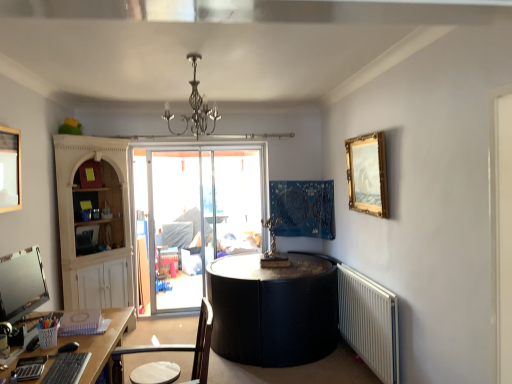
Question: From the image's perspective, is brown wooden chair at lower left located beneath white plastic radiator at lower right?

Choices:
 (A) no
 (B) yes

Answer: (A)

Question: Can you confirm if brown wooden chair at lower left is positioned to the left of white plastic radiator at lower right?

Choices:
 (A) no
 (B) yes

Answer: (B)

Question: Is brown wooden chair at lower left wider than white plastic radiator at lower right?

Choices:
 (A) yes
 (B) no

Answer: (A)

Question: From a real-world perspective, is brown wooden chair at lower left below white plastic radiator at lower right?

Choices:
 (A) yes
 (B) no

Answer: (B)

Question: From a real-world perspective, is brown wooden chair at lower left physically above white plastic radiator at lower right?

Choices:
 (A) yes
 (B) no

Answer: (A)

Question: Would you say white plastic radiator at lower right is part of brown wooden chair at lower left's contents?

Choices:
 (A) yes
 (B) no

Answer: (B)

Question: Does gold/gilded picture frame at upper right, the second picture frame when ordered from left to right, have a lesser height compared to white plastic radiator at lower right?

Choices:
 (A) yes
 (B) no

Answer: (A)

Question: Is gold/gilded picture frame at upper right, arranged as the second picture frame when viewed from the front, wider than white plastic radiator at lower right?

Choices:
 (A) yes
 (B) no

Answer: (A)

Question: Is white plastic radiator at lower right inside gold/gilded picture frame at upper right, the second picture frame when ordered from left to right?

Choices:
 (A) no
 (B) yes

Answer: (A)

Question: Is gold/gilded picture frame at upper right, the second picture frame when ordered from left to right, positioned behind white plastic radiator at lower right?

Choices:
 (A) yes
 (B) no

Answer: (A)

Question: Considering the relative positions of gold/gilded picture frame at upper right, the second picture frame when ordered from left to right, and white plastic radiator at lower right in the image provided, is gold/gilded picture frame at upper right, the second picture frame when ordered from left to right, to the right of white plastic radiator at lower right from the viewer's perspective?

Choices:
 (A) no
 (B) yes

Answer: (B)

Question: Is gold/gilded picture frame at upper right, which ranks as the 1th picture frame in back-to-front order, positioned before white plastic radiator at lower right?

Choices:
 (A) yes
 (B) no

Answer: (B)

Question: Can you confirm if wooden picture frame at upper left, positioned as the second picture frame in right-to-left order, is wider than white plastic radiator at lower right?

Choices:
 (A) yes
 (B) no

Answer: (B)